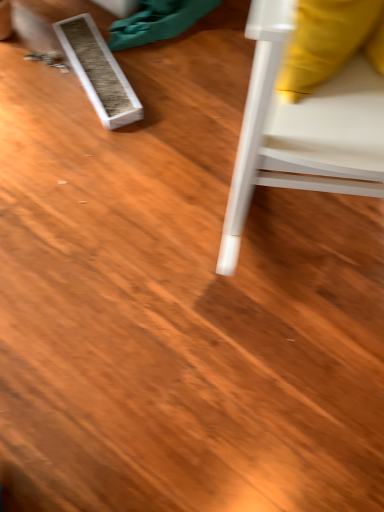
Question: Is white textured box at upper left wider or thinner than white plastic chair at right?

Choices:
 (A) thin
 (B) wide

Answer: (A)

Question: From the image's perspective, is white textured box at upper left positioned above or below white plastic chair at right?

Choices:
 (A) below
 (B) above

Answer: (B)

Question: Considering the positions of white textured box at upper left and white plastic chair at right in the image, is white textured box at upper left bigger or smaller than white plastic chair at right?

Choices:
 (A) small
 (B) big

Answer: (A)

Question: From a real-world perspective, is white plastic chair at right physically located above or below white textured box at upper left?

Choices:
 (A) below
 (B) above

Answer: (B)

Question: From the image's perspective, is white plastic chair at right positioned above or below white textured box at upper left?

Choices:
 (A) above
 (B) below

Answer: (B)

Question: In the image, is white plastic chair at right on the left side or the right side of white textured box at upper left?

Choices:
 (A) left
 (B) right

Answer: (B)

Question: From their relative heights in the image, would you say white plastic chair at right is taller or shorter than white textured box at upper left?

Choices:
 (A) tall
 (B) short

Answer: (A)